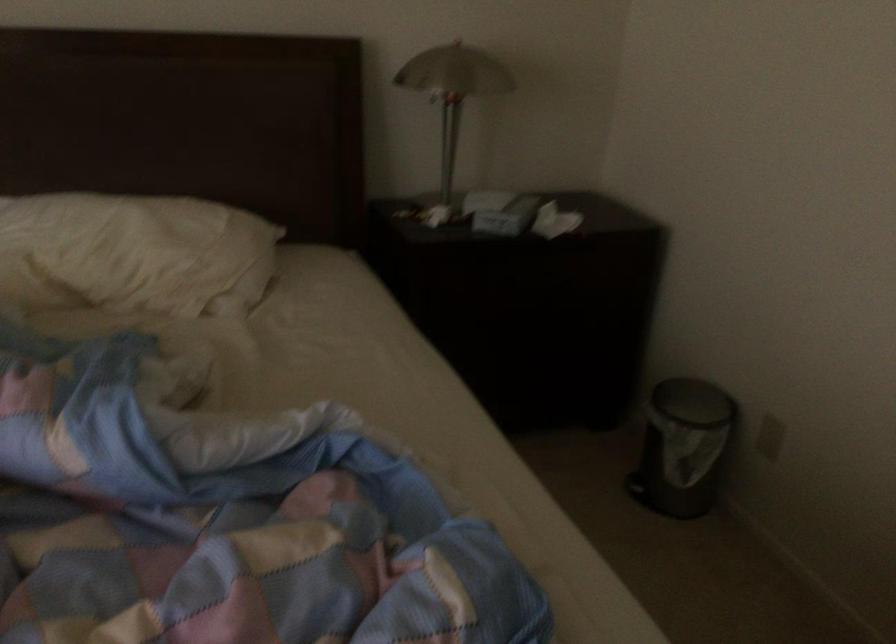
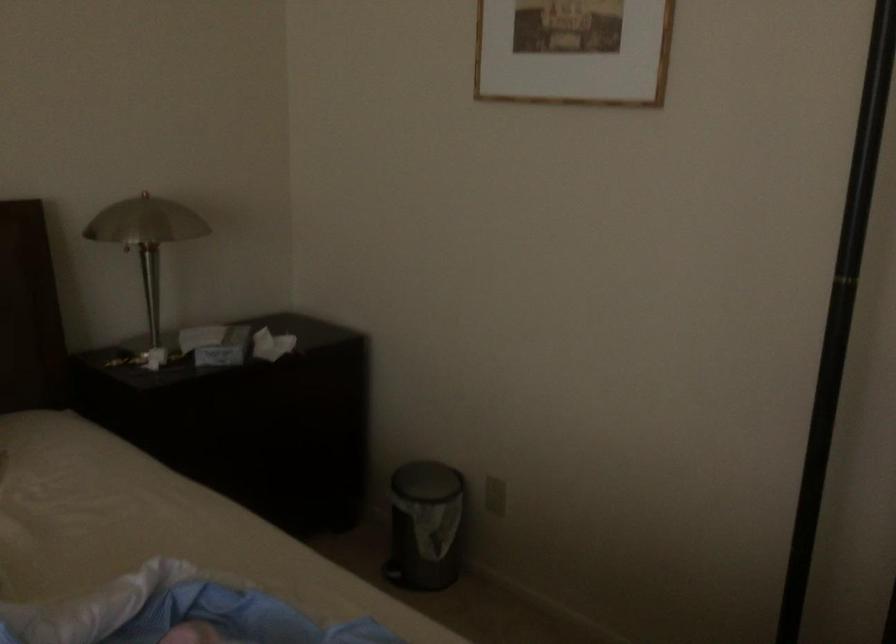
The point at (554, 222) is marked in the first image. Where is the corresponding point in the second image?

(271, 345)